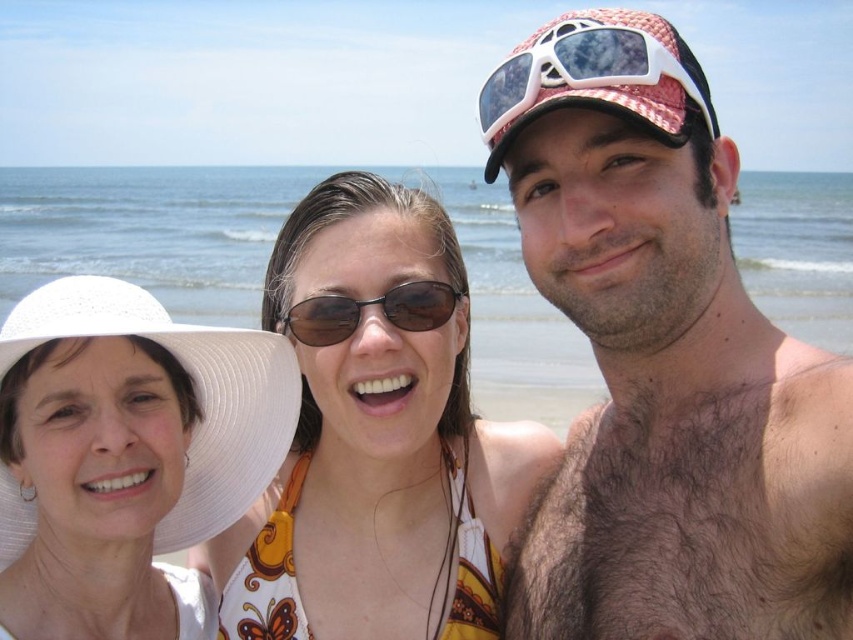
Question: Does pink mesh cap at upper right have a greater width compared to white fabric hat at left?

Choices:
 (A) yes
 (B) no

Answer: (B)

Question: Can you confirm if white fabric hat at left is positioned to the left of white plastic sunglasses at upper center?

Choices:
 (A) no
 (B) yes

Answer: (B)

Question: Which point appears closest to the camera in this image?

Choices:
 (A) (537, 86)
 (B) (402, 296)
 (C) (10, 557)

Answer: (A)

Question: Considering the real-world distances, which object is farthest from the black plastic sunglasses at center?

Choices:
 (A) white fabric hat at left
 (B) brown floral bikini top at center

Answer: (A)

Question: Does brown floral bikini top at center appear on the right side of black plastic sunglasses at center?

Choices:
 (A) yes
 (B) no

Answer: (A)

Question: Among these objects, which one is farthest from the camera?

Choices:
 (A) white fabric hat at left
 (B) pink mesh cap at upper right

Answer: (B)